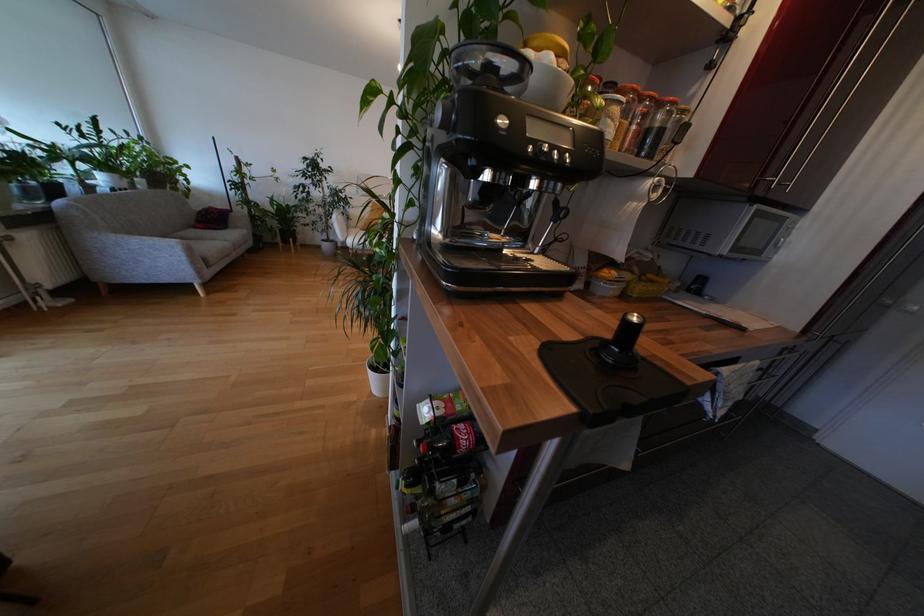
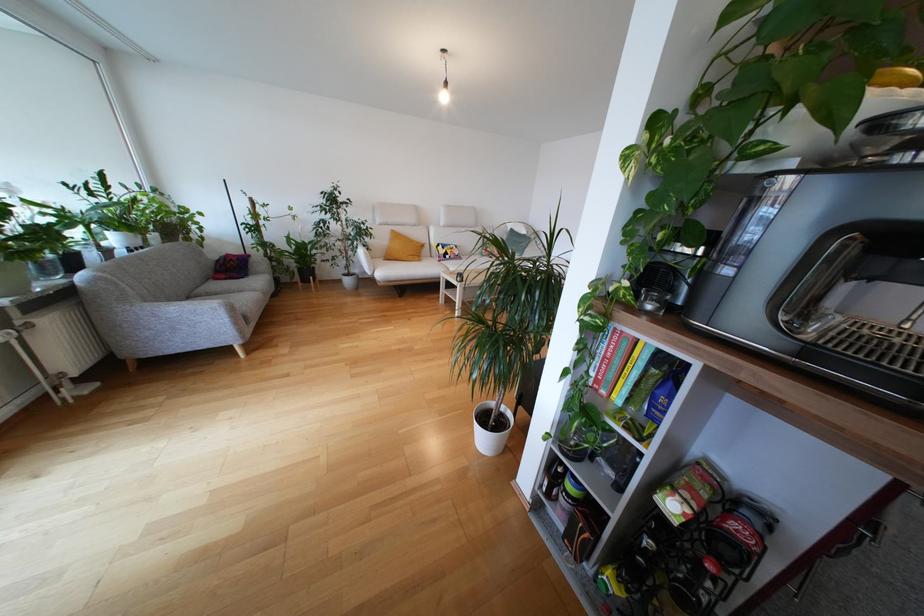
Locate, in the second image, the point that corresponds to [469,432] in the first image.

(750, 533)